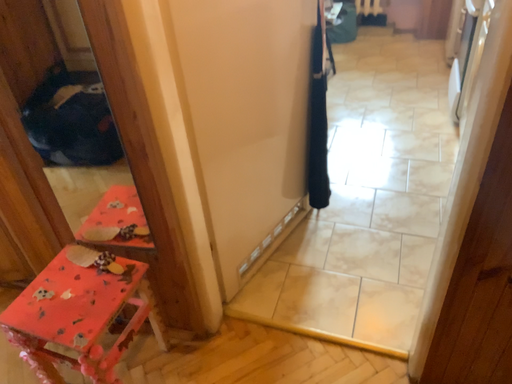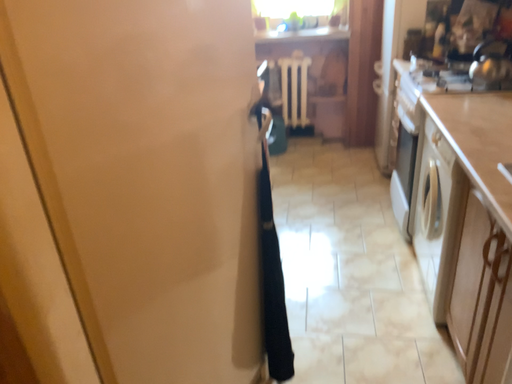
Question: How did the camera likely rotate when shooting the video?

Choices:
 (A) rotated left
 (B) rotated right

Answer: (B)